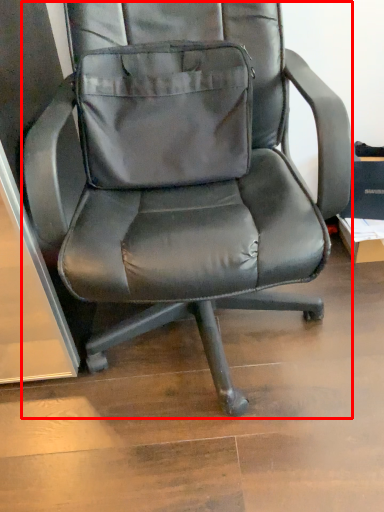
Question: From the image's perspective, what is the correct spatial relationship of chair (annotated by the red box) in relation to pocket?

Choices:
 (A) below
 (B) above

Answer: (A)